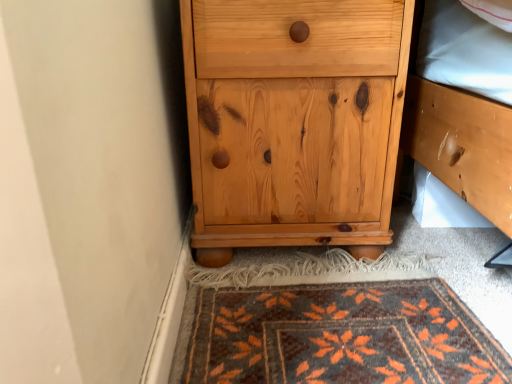
Question: From the image's perspective, is natural wood chest of drawers at lower center above or below dark brown woven rug at lower center?

Choices:
 (A) below
 (B) above

Answer: (B)

Question: Is point (367, 158) closer or farther from the camera than point (401, 364)?

Choices:
 (A) closer
 (B) farther

Answer: (B)

Question: Considering the positions of natural wood chest of drawers at lower center and dark brown woven rug at lower center in the image, is natural wood chest of drawers at lower center bigger or smaller than dark brown woven rug at lower center?

Choices:
 (A) small
 (B) big

Answer: (B)

Question: Would you say dark brown woven rug at lower center is to the left or to the right of natural wood chest of drawers at lower center in the picture?

Choices:
 (A) left
 (B) right

Answer: (B)

Question: Does point (285, 375) appear closer or farther from the camera than point (251, 201)?

Choices:
 (A) farther
 (B) closer

Answer: (B)

Question: Is dark brown woven rug at lower center in front of or behind natural wood chest of drawers at lower center in the image?

Choices:
 (A) behind
 (B) front

Answer: (B)

Question: Is dark brown woven rug at lower center wider or thinner than natural wood chest of drawers at lower center?

Choices:
 (A) thin
 (B) wide

Answer: (B)